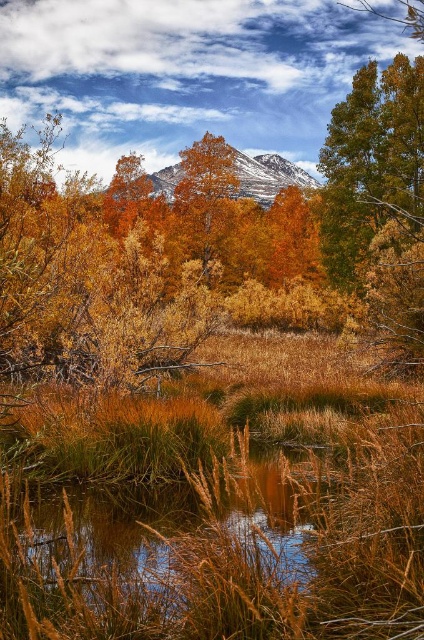
In the scene shown: Which of these two, golden textured tree at center or snowy rock mountain at upper center, stands taller?

Standing taller between the two is golden textured tree at center.

In the scene shown: Can you confirm if golden textured tree at center is thinner than snowy rock mountain at upper center?

Correct, golden textured tree at center's width is less than snowy rock mountain at upper center's.

Locate an element on the screen. This screenshot has height=640, width=424. golden textured tree at center is located at coordinates (204, 198).